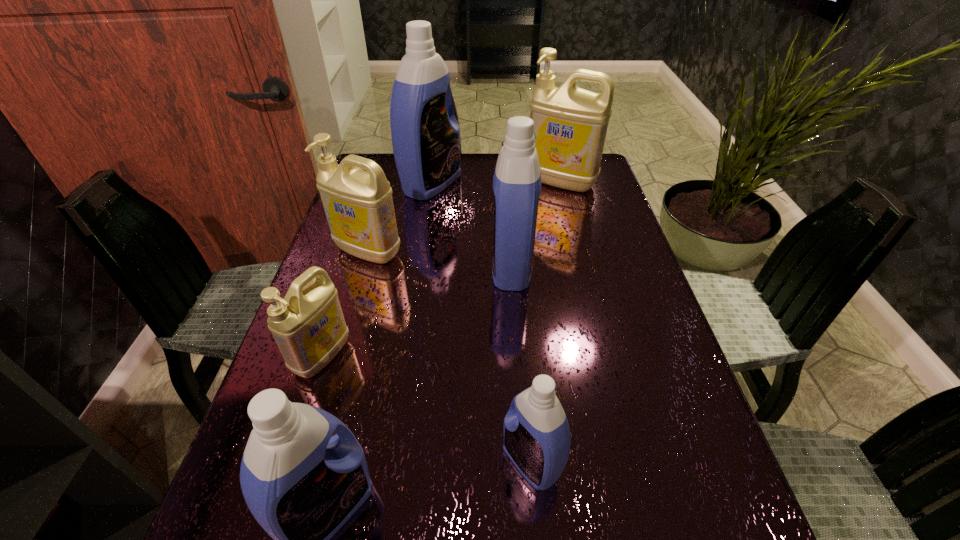
Locate an element on the screen. The width and height of the screenshot is (960, 540). vacant space situated 0.130m on the front of the biggest beige detergent is located at coordinates (571, 224).

I want to click on vacant region located 0.070m on the front of the third nearest blue detergent, so click(516, 318).

Where is `vacant region located on the right of the second farthest beige detergent`? The height and width of the screenshot is (540, 960). vacant region located on the right of the second farthest beige detergent is located at coordinates (492, 252).

At what (x,y) coordinates should I click in order to perform the action: click on free spot located 0.070m on the right of the fifth farthest detergent. Please return your answer as a coordinate pair (x, y). This screenshot has width=960, height=540. Looking at the image, I should click on (382, 356).

Locate an element on the screen. This screenshot has height=540, width=960. blank space located 0.270m on the back of the smallest blue detergent is located at coordinates (518, 315).

You are a GUI agent. You are given a task and a screenshot of the screen. Output one action in this format:
    pyautogui.click(x=<x>, y=<y>)
    Task: Click on the object that is at the right edge
    
    Given the screenshot: What is the action you would take?
    pyautogui.click(x=570, y=123)

Identify the location of object located in the far left corner section of the desktop. The height and width of the screenshot is (540, 960). (425, 134).

What are the coordinates of `object present at the far right corner` in the screenshot? It's located at (570, 123).

In the image, there is a desktop. Identify the location of free region at the far edge. Image resolution: width=960 pixels, height=540 pixels. (446, 191).

This screenshot has width=960, height=540. I want to click on vacant area at the left edge of the desktop, so click(x=305, y=382).